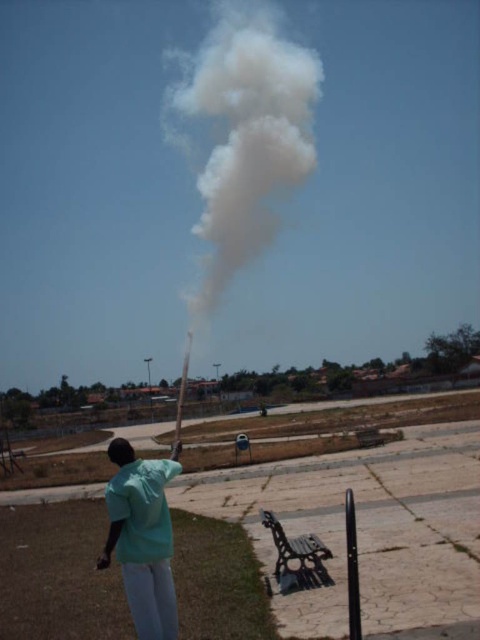
Question: Which point is closer to the camera?

Choices:
 (A) green fabric shirt at center
 (B) white fluffy smoke at center

Answer: (A)

Question: Which point appears farthest from the camera in this image?

Choices:
 (A) (149, 534)
 (B) (250, 16)

Answer: (B)

Question: Does white fluffy smoke at center have a lesser width compared to green fabric shirt at center?

Choices:
 (A) yes
 (B) no

Answer: (B)

Question: Can you confirm if white fluffy smoke at center is positioned to the left of green fabric shirt at center?

Choices:
 (A) yes
 (B) no

Answer: (B)

Question: Is white fluffy smoke at center further to camera compared to green fabric shirt at center?

Choices:
 (A) yes
 (B) no

Answer: (A)